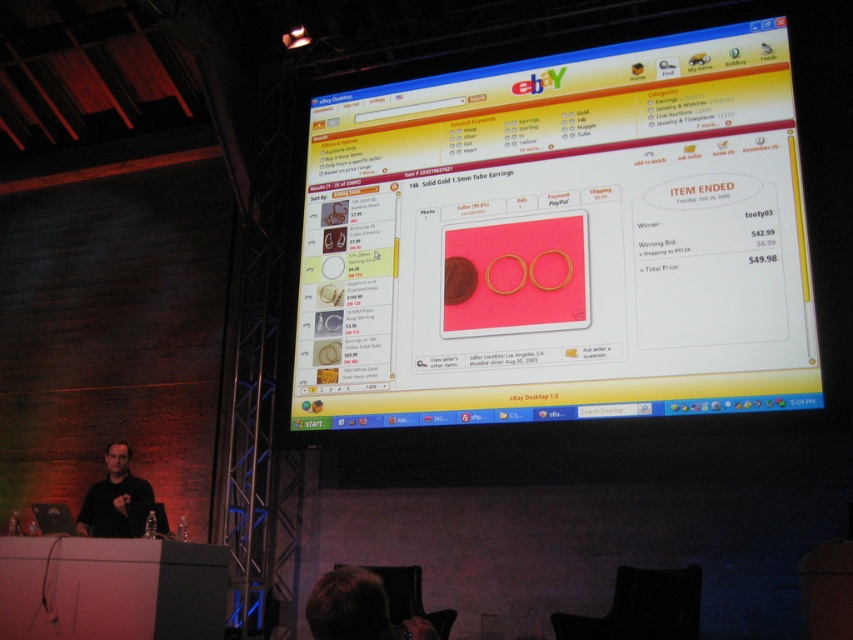
Question: In this image, where is pink matte earrings at center located relative to dark brown hair at lower center?

Choices:
 (A) above
 (B) below

Answer: (A)

Question: In this image, where is pink matte earrings at center located relative to black matte shirt at lower left?

Choices:
 (A) below
 (B) above

Answer: (B)

Question: Which point appears farthest from the camera in this image?

Choices:
 (A) (366, 573)
 (B) (109, 460)

Answer: (B)

Question: Which object is the farthest from the dark brown hair at lower center?

Choices:
 (A) pink matte earrings at center
 (B) black matte shirt at lower left

Answer: (B)

Question: Which is nearer to the black matte shirt at lower left?

Choices:
 (A) dark brown hair at lower center
 (B) pink matte earrings at center

Answer: (B)

Question: Does pink matte earrings at center come in front of dark brown hair at lower center?

Choices:
 (A) yes
 (B) no

Answer: (B)